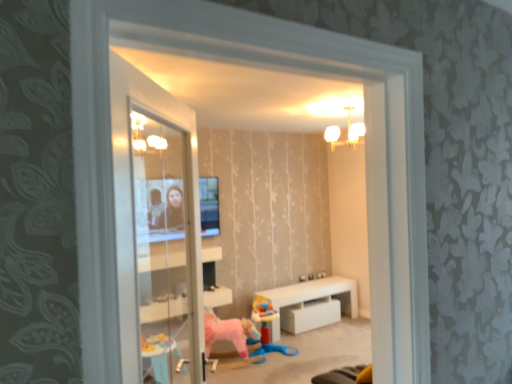
The height and width of the screenshot is (384, 512). Describe the element at coordinates (348, 132) in the screenshot. I see `white frosted glass chandelier at upper center` at that location.

Describe the element at coordinates (228, 332) in the screenshot. The width and height of the screenshot is (512, 384). I see `pink fabric horse at center` at that location.

What do you see at coordinates (275, 168) in the screenshot?
I see `transparent glass window at center` at bounding box center [275, 168].

Describe the element at coordinates (312, 304) in the screenshot. I see `white glossy table at center` at that location.

In order to click on white frosted glass chandelier at upper center in this screenshot , I will do `click(348, 132)`.

From the image's perspective, is plastic blue toy at center located above white glossy table at center?

Incorrect, from the image's perspective, plastic blue toy at center is lower than white glossy table at center.

Which of these two, plastic blue toy at center or white glossy table at center, is wider?

With larger width is plastic blue toy at center.

Who is more distant, plastic blue toy at center or white glossy table at center?

white glossy table at center is further from the camera.

From a real-world perspective, is plastic blue toy at center physically located above or below white glossy table at center?

plastic blue toy at center is situated higher than white glossy table at center in the real world.

Are transparent glass window at center and plastic blue toy at center making contact?

No, transparent glass window at center is not making contact with plastic blue toy at center.

Between transparent glass window at center and plastic blue toy at center, which one appears on the right side from the viewer's perspective?

transparent glass window at center is more to the right.

Which object is more forward, transparent glass window at center or plastic blue toy at center?

Positioned in front is transparent glass window at center.

How distant is transparent glass window at center from plastic blue toy at center?

The distance of transparent glass window at center from plastic blue toy at center is 3.69 feet.

Consider the image. Does transparent glass window at center appear on the right side of white glossy table at center?

In fact, transparent glass window at center is to the left of white glossy table at center.

Looking at the image, does transparent glass window at center seem bigger or smaller compared to white glossy table at center?

transparent glass window at center is bigger than white glossy table at center.

Identify the location of window in front of the white glossy table at center. This screenshot has height=384, width=512. (275, 168).

Would you say transparent glass window at center is inside or outside white glossy table at center?

The correct answer is: outside.

Is white frosted glass chandelier at upper center positioned with its back to white glossy table at center?

No, white frosted glass chandelier at upper center is not facing the opposite direction of white glossy table at center.

Considering the relative positions of white frosted glass chandelier at upper center and white glossy table at center in the image provided, is white frosted glass chandelier at upper center to the left of white glossy table at center from the viewer's perspective?

In fact, white frosted glass chandelier at upper center is to the right of white glossy table at center.

Is white frosted glass chandelier at upper center in front of or behind white glossy table at center in the image?

In the image, white frosted glass chandelier at upper center appears in front of white glossy table at center.

Are white frosted glass chandelier at upper center and white glossy table at center far apart?

Yes.

Does white frosted glass chandelier at upper center turn towards pink fabric horse at center?

No, white frosted glass chandelier at upper center is not facing towards pink fabric horse at center.

From a real-world perspective, is white frosted glass chandelier at upper center above or below pink fabric horse at center?

Clearly, from a real-world perspective, white frosted glass chandelier at upper center is above pink fabric horse at center.

Is there a large distance between white frosted glass chandelier at upper center and pink fabric horse at center?

white frosted glass chandelier at upper center is positioned a significant distance from pink fabric horse at center.

Does white frosted glass chandelier at upper center have a lesser width compared to pink fabric horse at center?

No, white frosted glass chandelier at upper center is not thinner than pink fabric horse at center.

From a real-world perspective, is white glossy table at center located beneath pink fabric horse at center?

Yes, from a real-world perspective, white glossy table at center is under pink fabric horse at center.

Is white glossy table at center located outside pink fabric horse at center?

white glossy table at center is positioned outside pink fabric horse at center.

From the picture: From the image's perspective, which one is positioned lower, white glossy table at center or pink fabric horse at center?

white glossy table at center, from the image's perspective.

Based on the photo, between white glossy table at center and pink fabric horse at center, which one appears on the left side from the viewer's perspective?

Positioned to the left is pink fabric horse at center.

What's the angular difference between transparent glass window at center and white frosted glass chandelier at upper center's facing directions?

The facing directions of transparent glass window at center and white frosted glass chandelier at upper center are 180 degrees apart.

Is point (340, 156) positioned before point (335, 137)?

No, it is not.

Between transparent glass window at center and white frosted glass chandelier at upper center, which one has smaller width?

transparent glass window at center is thinner.

From a real-world perspective, is transparent glass window at center over white frosted glass chandelier at upper center?

No.

Locate an element on the screen. The image size is (512, 384). toy located in front of the white glossy table at center is located at coordinates (267, 329).

You are a GUI agent. You are given a task and a screenshot of the screen. Output one action in this format:
    pyautogui.click(x=<x>, y=<y>)
    Task: Click on the window above the plastic blue toy at center (from a real-world perspective)
    This screenshot has height=384, width=512.
    Given the screenshot: What is the action you would take?
    pyautogui.click(x=275, y=168)

Considering their positions, is pink fabric horse at center positioned further to white frosted glass chandelier at upper center than white glossy table at center?

pink fabric horse at center is further to white frosted glass chandelier at upper center.

When comparing their distances from white glossy table at center, does pink fabric horse at center or transparent glass window at center seem closer?

transparent glass window at center is closer to white glossy table at center.

Based on their spatial positions, is pink fabric horse at center or plastic blue toy at center further from white glossy table at center?

pink fabric horse at center.

Looking at the image, which one is located further to plastic blue toy at center, transparent glass window at center or pink fabric horse at center?

transparent glass window at center is further to plastic blue toy at center.

Estimate the real-world distances between objects in this image. Which object is closer to white glossy table at center, pink fabric horse at center or white frosted glass chandelier at upper center?

pink fabric horse at center is positioned closer to the anchor white glossy table at center.

Looking at the image, which one is located further to transparent glass window at center, white glossy table at center or plastic blue toy at center?

Among the two, plastic blue toy at center is located further to transparent glass window at center.

Looking at the image, which one is located further to transparent glass window at center, white glossy table at center or pink fabric horse at center?

pink fabric horse at center is positioned further to the anchor transparent glass window at center.

From the image, which object appears to be farther from white frosted glass chandelier at upper center, pink fabric horse at center or transparent glass window at center?

Based on the image, pink fabric horse at center appears to be further to white frosted glass chandelier at upper center.

This screenshot has height=384, width=512. Identify the location of toy between transparent glass window at center and white glossy table at center from front to back. (267, 329).

Identify the location of animal between transparent glass window at center and plastic blue toy at center from front to back. The width and height of the screenshot is (512, 384). (228, 332).

You are a GUI agent. You are given a task and a screenshot of the screen. Output one action in this format:
    pyautogui.click(x=<x>, y=<y>)
    Task: Click on the light fixture positioned between transparent glass window at center and plastic blue toy at center from near to far
    This screenshot has height=384, width=512.
    Given the screenshot: What is the action you would take?
    pyautogui.click(x=348, y=132)

The width and height of the screenshot is (512, 384). I want to click on toy between pink fabric horse at center and white glossy table at center from left to right, so click(x=267, y=329).